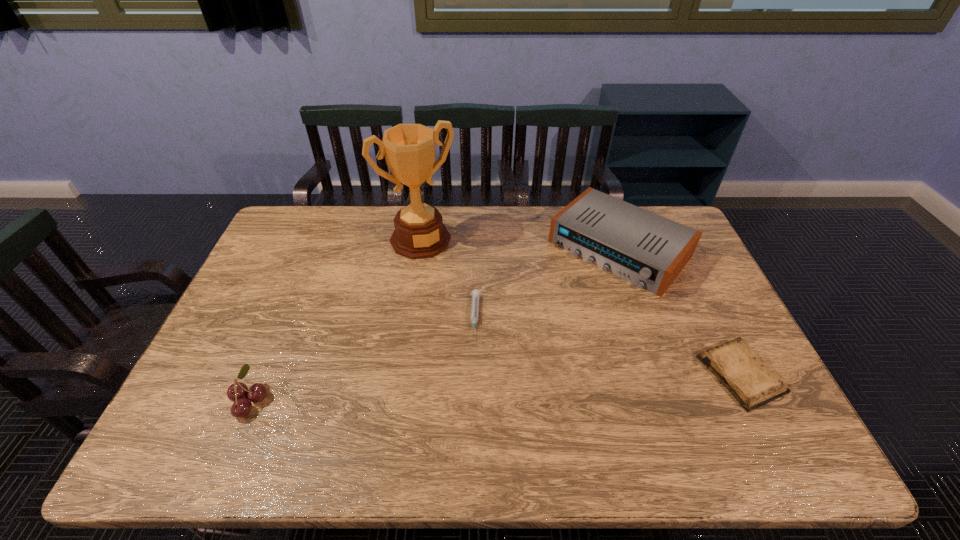
Find the location of a particular element. vacant space located at the needle end of the shortest object is located at coordinates (474, 356).

Identify the location of vacant space located 0.160m at the needle end of the shortest object. (472, 392).

The image size is (960, 540). I want to click on free point located 0.310m on the front panel of the radio receiver, so click(523, 346).

This screenshot has width=960, height=540. I want to click on vacant space located 0.230m on the front panel of the radio receiver, so click(540, 328).

Where is `vacant space positioned 0.060m on the front panel of the radio receiver`? vacant space positioned 0.060m on the front panel of the radio receiver is located at coordinates pos(572,295).

Where is `vacant space located on the front-facing side of the second object from left to right`? The height and width of the screenshot is (540, 960). vacant space located on the front-facing side of the second object from left to right is located at coordinates (474, 321).

The height and width of the screenshot is (540, 960). I want to click on vacant region located 0.100m on the front-facing side of the second object from left to right, so click(x=446, y=276).

I want to click on free region located on the front-facing side of the second object from left to right, so click(x=443, y=271).

Where is `radio receiver that is at the far edge`? Image resolution: width=960 pixels, height=540 pixels. radio receiver that is at the far edge is located at coordinates click(x=644, y=248).

I want to click on award that is at the far edge, so click(409, 149).